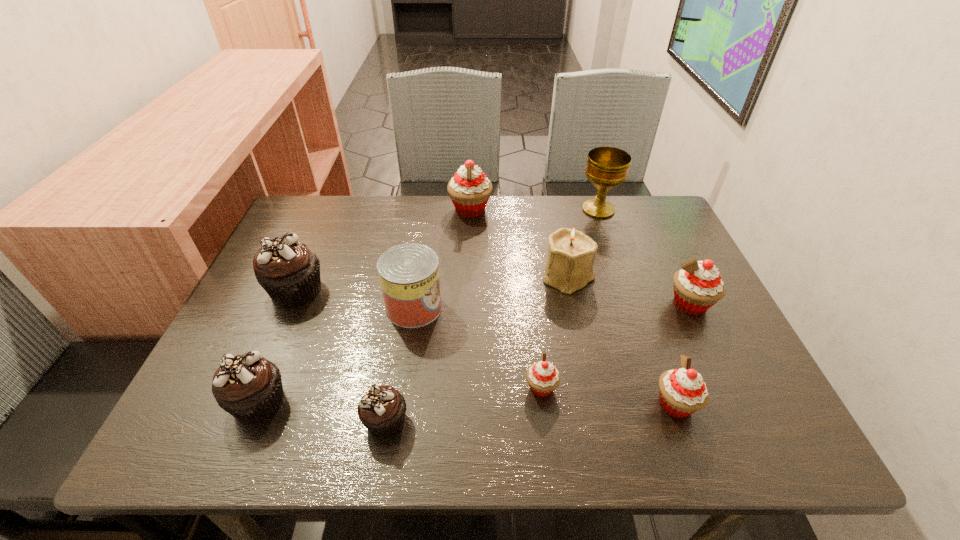
Where is `the farthest cupcake`? the farthest cupcake is located at coordinates click(469, 189).

The width and height of the screenshot is (960, 540). I want to click on the farthest pink cupcake, so click(x=469, y=189).

Find the location of `chalice`. chalice is located at coordinates (607, 167).

Locate an element on the screen. The height and width of the screenshot is (540, 960). beige candle_holder is located at coordinates (569, 266).

Identify the location of candle_holder. (569, 266).

You are a GUI agent. You are given a task and a screenshot of the screen. Output one action in this format:
    pyautogui.click(x=<x>, y=<y>)
    Task: Click on the biggest brown cupcake
    This screenshot has height=540, width=960.
    Given the screenshot: What is the action you would take?
    pyautogui.click(x=287, y=270)

The height and width of the screenshot is (540, 960). I want to click on the rightmost pink cupcake, so click(x=697, y=286).

Locate an element on the screen. the second biggest pink cupcake is located at coordinates (697, 286).

Locate an element on the screen. The height and width of the screenshot is (540, 960). can is located at coordinates (409, 273).

At what (x,y) coordinates should I click in order to perform the action: click on the second pink cupcake from right to left. Please return your answer as a coordinate pair (x, y). This screenshot has height=540, width=960. Looking at the image, I should click on (682, 391).